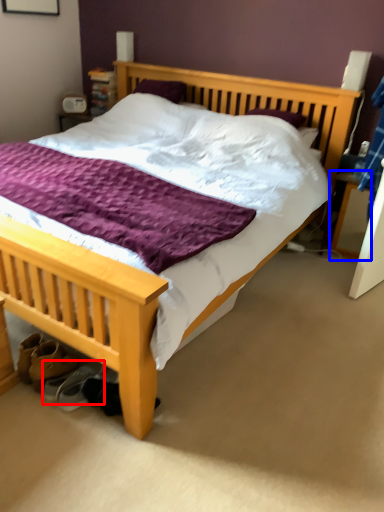
Question: Among these objects, which one is farthest to the camera, shoe (highlighted by a red box) or nightstand (highlighted by a blue box)?

Choices:
 (A) shoe
 (B) nightstand

Answer: (B)